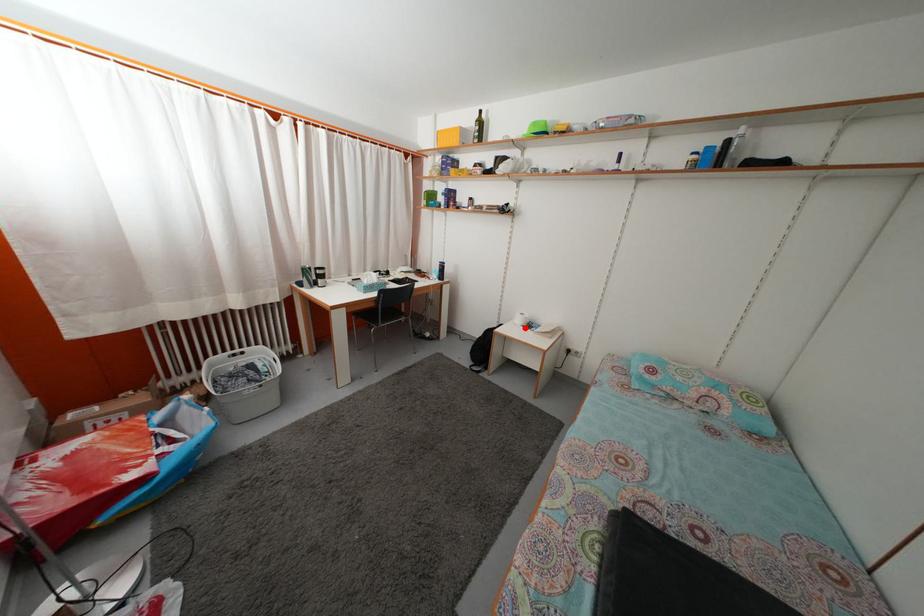
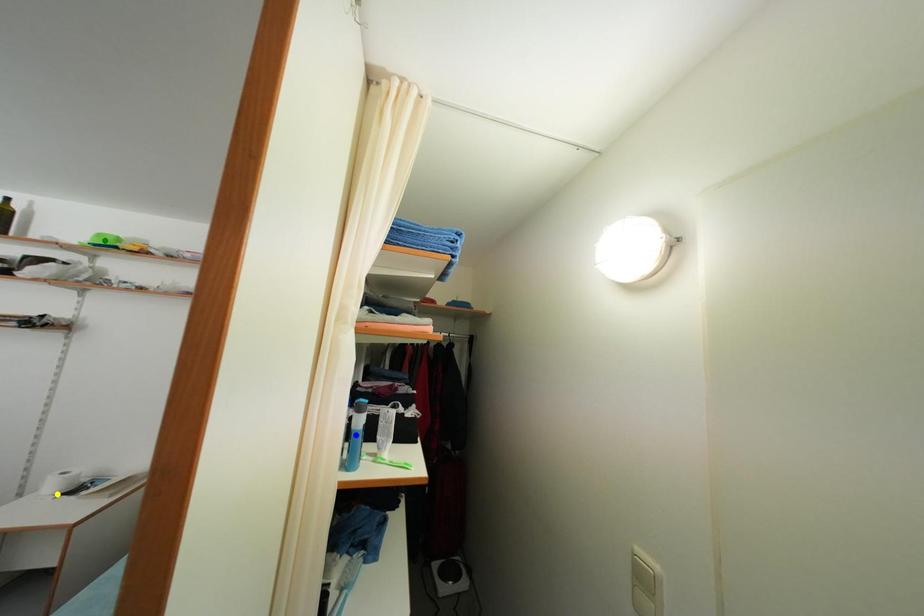
Question: I am providing you with two images of the same scene from different viewpoints. A red point is marked on the first image. You are given multiple points on the second image. Which point in image 2 is actually the same real-world point as the red point in image 1?

Choices:
 (A) yellow point
 (B) blue point
 (C) green point

Answer: (A)